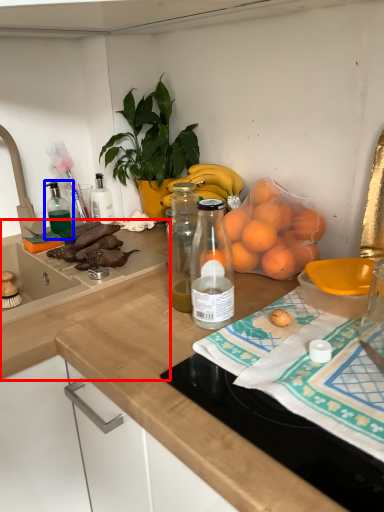
Question: Which point is further to the camera, countertop (highlighted by a red box) or bottle (highlighted by a blue box)?

Choices:
 (A) countertop
 (B) bottle

Answer: (B)